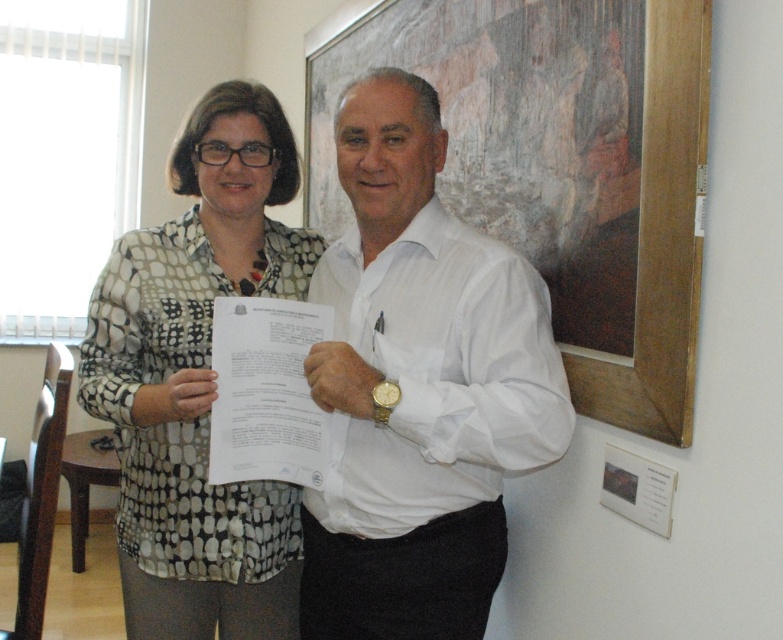
You are an interior designer observing the two people in the image. You need to determine which clothing item is smaller in size between the white smooth shirt at center and the polka dot blouse at center. Which one is smaller?

A: The white smooth shirt at center is smaller in size compared to the polka dot blouse at center according to the description.

You are an interior designer assessing the layout of an office. You notice the white smooth shirt at center and the polka dot blouse at center. Which clothing item has a greater horizontal extent in the image?

The white smooth shirt at center has a greater horizontal extent than the polka dot blouse at center because its width surpasses the latter.